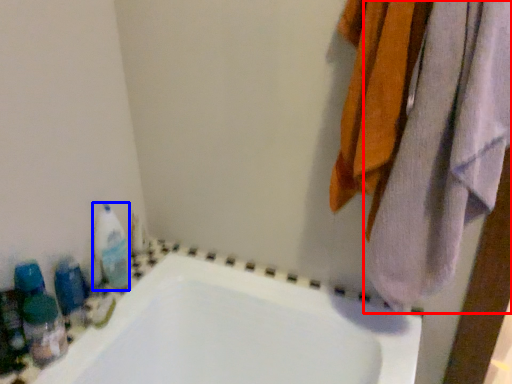
Question: Among these objects, which one is nearest to the camera, towel (highlighted by a red box) or cleaning product (highlighted by a blue box)?

Choices:
 (A) towel
 (B) cleaning product

Answer: (A)